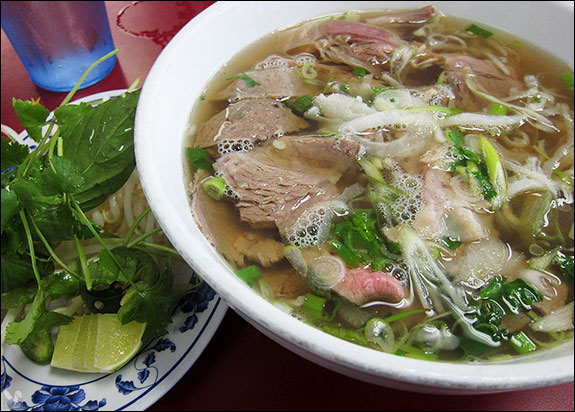
You are a GUI agent. You are given a task and a screenshot of the screen. Output one action in this format:
    pyautogui.click(x=<x>, y=<y>)
    Task: Click on the red cup
    The image size is (575, 412).
    Given the screenshot: What is the action you would take?
    pyautogui.click(x=154, y=20)